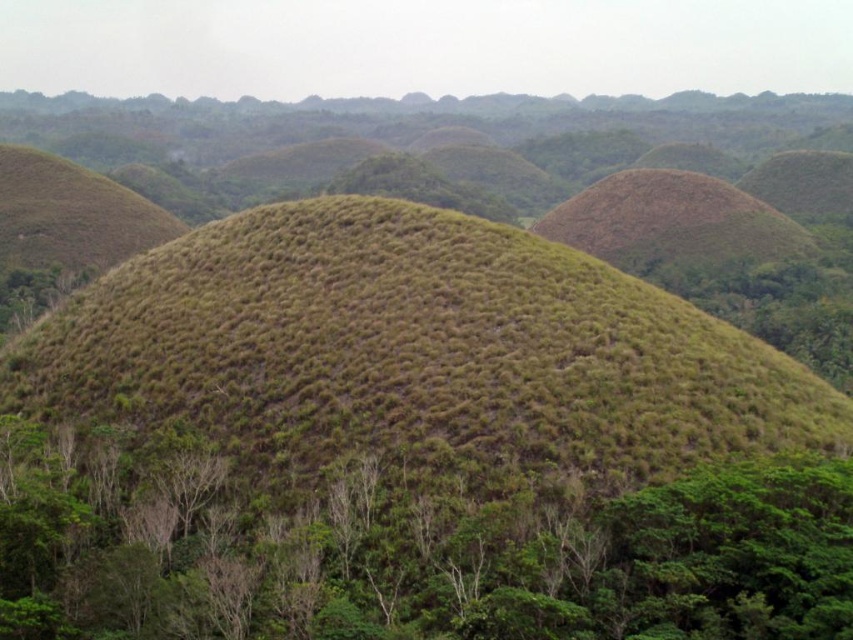
Question: Which point is farther to the camera?

Choices:
 (A) brown grassy mound at upper right
 (B) green leafy tree at center

Answer: (A)

Question: Does green leafy tree at center appear over brown grassy mound at upper right?

Choices:
 (A) no
 (B) yes

Answer: (A)

Question: In this image, where is green leafy tree at center located relative to brown grassy mound at upper right?

Choices:
 (A) below
 (B) above

Answer: (A)

Question: Is green leafy tree at center positioned before brown grassy mound at upper right?

Choices:
 (A) yes
 (B) no

Answer: (A)